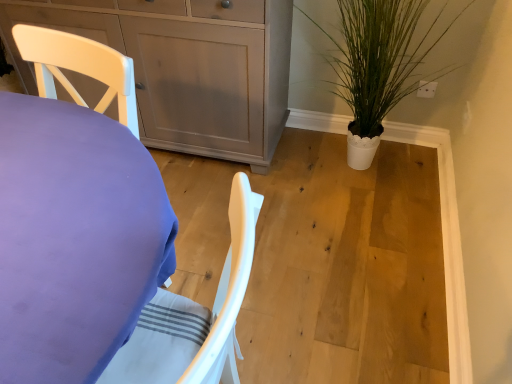
Question: Is matte gray cabinet at upper left turned away from white matte pot at right?

Choices:
 (A) no
 (B) yes

Answer: (A)

Question: Does matte gray cabinet at upper left have a lesser height compared to white matte pot at right?

Choices:
 (A) no
 (B) yes

Answer: (A)

Question: Could you tell me if matte gray cabinet at upper left is facing white matte pot at right?

Choices:
 (A) no
 (B) yes

Answer: (A)

Question: Is white matte pot at right surrounded by matte gray cabinet at upper left?

Choices:
 (A) yes
 (B) no

Answer: (B)

Question: From the image's perspective, is matte gray cabinet at upper left located beneath white matte pot at right?

Choices:
 (A) yes
 (B) no

Answer: (B)

Question: Does matte gray cabinet at upper left lie behind white matte pot at right?

Choices:
 (A) no
 (B) yes

Answer: (B)

Question: From the image's perspective, does purple fabric-covered desk at left appear higher than white matte pot at right?

Choices:
 (A) yes
 (B) no

Answer: (B)

Question: Does purple fabric-covered desk at left have a greater width compared to white matte pot at right?

Choices:
 (A) yes
 (B) no

Answer: (B)

Question: Is purple fabric-covered desk at left closer to camera compared to white matte pot at right?

Choices:
 (A) no
 (B) yes

Answer: (B)

Question: Could you tell me if purple fabric-covered desk at left is turned towards white matte pot at right?

Choices:
 (A) no
 (B) yes

Answer: (A)

Question: Is purple fabric-covered desk at left to the right of white matte pot at right from the viewer's perspective?

Choices:
 (A) no
 (B) yes

Answer: (A)

Question: From a real-world perspective, is purple fabric-covered desk at left over white matte pot at right?

Choices:
 (A) no
 (B) yes

Answer: (B)

Question: Can you confirm if purple fabric-covered desk at left is wider than matte gray cabinet at upper left?

Choices:
 (A) yes
 (B) no

Answer: (A)